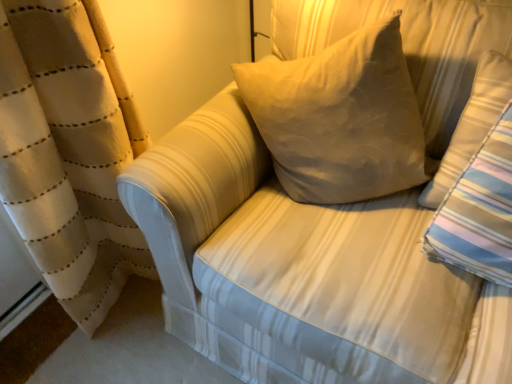
Find the location of a particular element. striped fabric pillow at right is located at coordinates click(x=472, y=124).

Describe the element at coordinates (472, 124) in the screenshot. I see `striped fabric pillow at right` at that location.

Identify the location of striped fabric pillow at right. This screenshot has width=512, height=384. (472, 124).